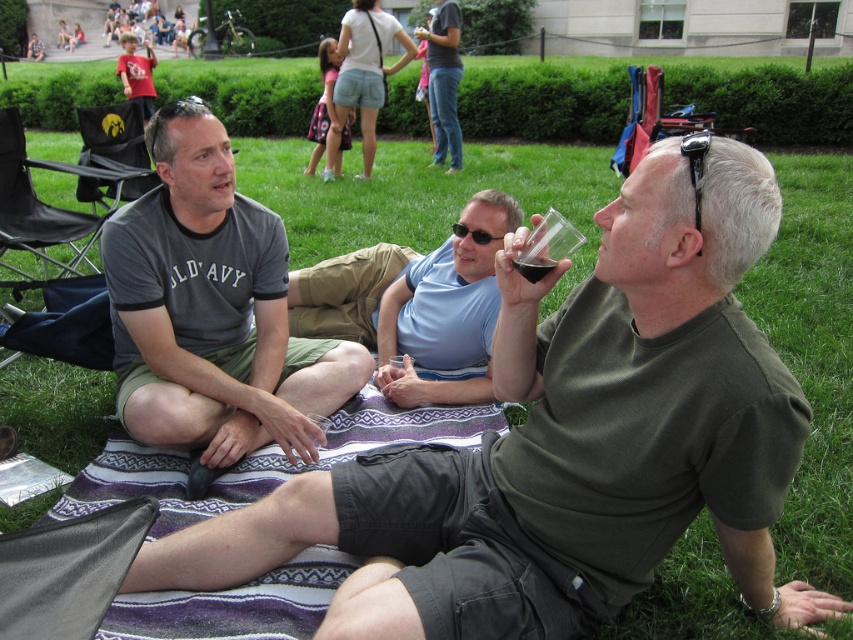
Who is more distant from viewer, (x=741, y=532) or (x=167, y=413)?

The point (x=167, y=413) is more distant.

Does matte green t-shirt at center have a lesser height compared to gray cotton t-shirt at left?

Yes.

Is point (697, 266) positioned behind point (201, 472)?

That is False.

Identify the location of matte green t-shirt at center. This screenshot has height=640, width=853. (596, 422).

From the picture: Does gray cotton t-shirt at left have a lesser height compared to black rubber sunglasses at upper right?

In fact, gray cotton t-shirt at left may be taller than black rubber sunglasses at upper right.

Does gray cotton t-shirt at left appear under black rubber sunglasses at upper right?

Yes, gray cotton t-shirt at left is below black rubber sunglasses at upper right.

Does point (315, 365) come farther from viewer compared to point (695, 154)?

Yes.

Locate an element on the screen. The height and width of the screenshot is (640, 853). gray cotton t-shirt at left is located at coordinates (212, 310).

Who is more forward, (383,316) or (701,148)?

Point (701,148) is more forward.

Is point (460, 285) closer to viewer compared to point (692, 156)?

That is False.

The height and width of the screenshot is (640, 853). Describe the element at coordinates (445, 308) in the screenshot. I see `light blue fabric at center` at that location.

Locate an element on the screen. This screenshot has width=853, height=640. light blue fabric at center is located at coordinates (445, 308).